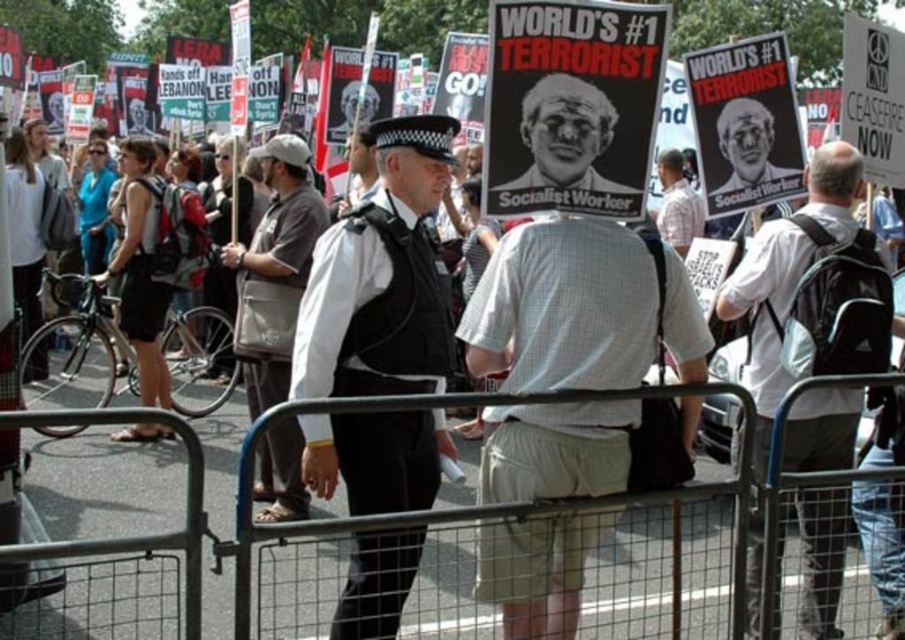
You are standing at the viewpoint of the image and want to reach the point marked as point (389, 116). Considering your walking speed is 1.5 meters per second, how many seconds will it take you to reach that point?

The point (389, 116) is 29.16 meters away from the viewer. At a walking speed of 1.5 meters per second, it would take approximately 19.44 seconds to reach it.

You are a photographer trying to capture a clear photo of both the white checkered shirt at center and the black matte poster at center. Based on their sizes in the image, which one would appear larger in your photo?

The white checkered shirt at center appears larger in the photo because it is bigger than the black matte poster at center according to the description.

You are a photographer standing behind the metal barricade in the protest scene. You want to take a clear photo of the khaki canvas bag at center. Since the barricade is in your way, can you still capture the bag in your shot? Explain why or why not based on its position.

The khaki canvas bag at center is located at coordinates point (275, 262). Since the barricade is in the foreground blocking the direct line of sight, it depends on whether the photographer can adjust their angle or position to see around or over the barricade. However, without additional information about the barricade height or the photographer mobility, we cannot definitively confirm if the bag is visible.